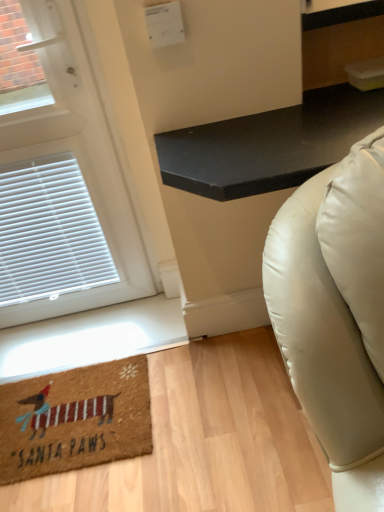
The image size is (384, 512). I want to click on free space in front of white matte door at upper left, so click(89, 380).